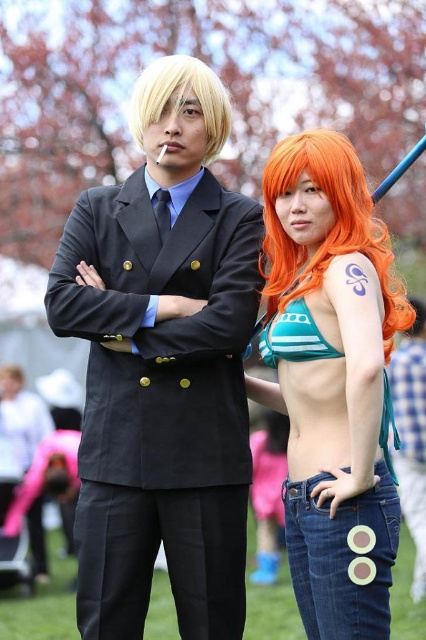
Does matte black suit at center have a greater height compared to blonde synthetic wig at center?

Correct, matte black suit at center is much taller as blonde synthetic wig at center.

Does point (189, 368) come farther from viewer compared to point (209, 72)?

No.

Locate an element on the screen. This screenshot has width=426, height=640. matte black suit at center is located at coordinates (164, 365).

Does orange synthetic wig at right have a greater height compared to blonde synthetic wig at center?

Incorrect, orange synthetic wig at right's height is not larger of blonde synthetic wig at center's.

Is orange synthetic wig at right positioned at the back of blonde synthetic wig at center?

That is False.

Where is `orange synthetic wig at right`? orange synthetic wig at right is located at coordinates (331, 227).

Between orange hair at right and blonde synthetic wig at center, which one has more height?

orange hair at right is taller.

Which of these two, orange hair at right or blonde synthetic wig at center, stands shorter?

With less height is blonde synthetic wig at center.

Which is behind, point (359, 232) or point (137, 120)?

The point (137, 120) is more distant.

Identify the location of orange hair at right. (331, 380).